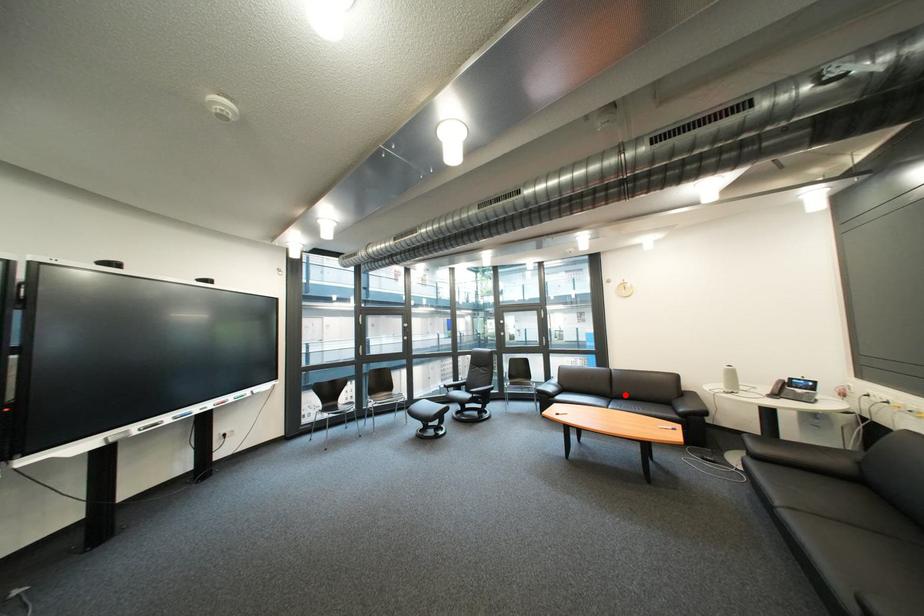
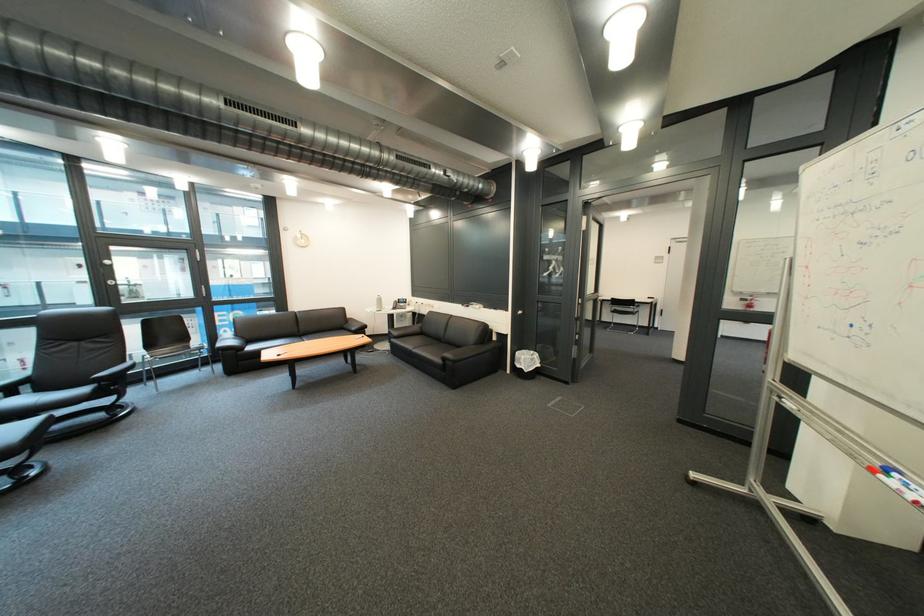
Locate, in the second image, the point that corresponds to the highlighted location in the first image.

(312, 334)